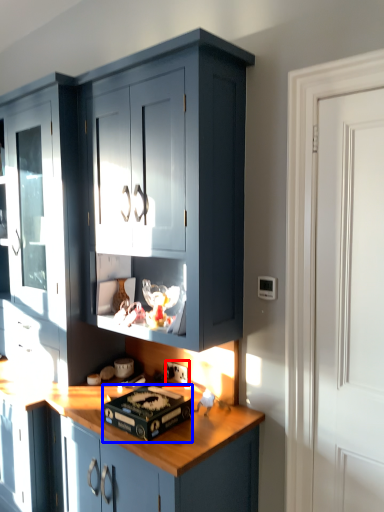
Question: Which object appears farthest to the camera in this image, electric outlet (highlighted by a red box) or appliance (highlighted by a blue box)?

Choices:
 (A) electric outlet
 (B) appliance

Answer: (A)